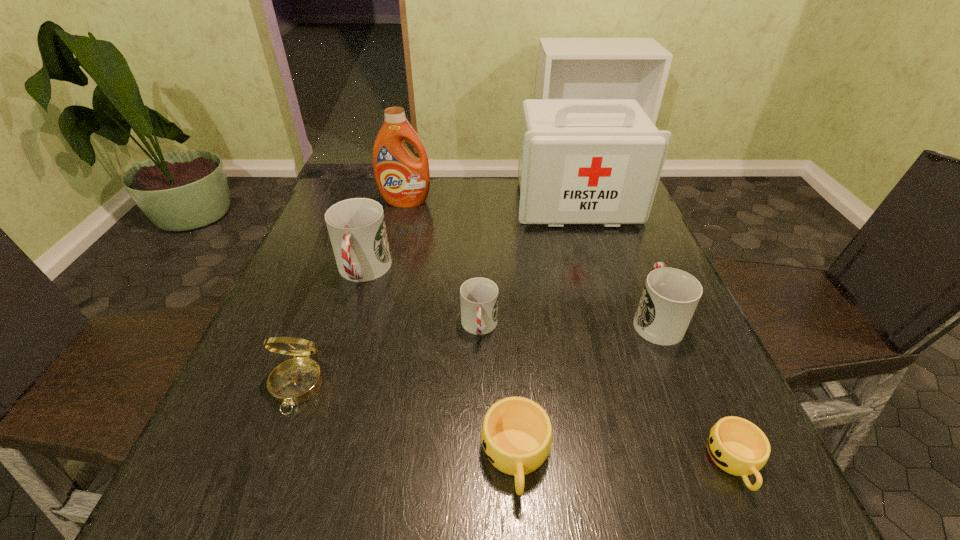
Locate an element on the screen. The image size is (960, 540). free space between the white first-aid kit and the third tallest cup is located at coordinates coord(527,265).

Image resolution: width=960 pixels, height=540 pixels. Identify the location of free spot between the third tallest cup and the second tallest cup. (567, 323).

Find the location of `unoccupied area between the detergent and the second red cup from left to right`. unoccupied area between the detergent and the second red cup from left to right is located at coordinates (443, 265).

The height and width of the screenshot is (540, 960). In order to click on unoccupied area between the sixth shortest object and the third nearest object in this screenshot , I will do `click(329, 329)`.

The image size is (960, 540). Find the location of `vacant area that lies between the first-aid kit and the third tallest object`. vacant area that lies between the first-aid kit and the third tallest object is located at coordinates (469, 237).

Identify the location of free space between the third nearest object and the second biggest red cup. (476, 353).

The image size is (960, 540). In order to click on object that is the fifth closest to the second shortest object in this screenshot , I will do `click(356, 227)`.

Locate an element on the screen. the fifth closest object to the shortest cup is located at coordinates (295, 381).

Where is `cup that stands as the second closest to the first-aid kit`? cup that stands as the second closest to the first-aid kit is located at coordinates (478, 296).

Locate which cup is the third closest to the tallest cup. Please provide its 2D coordinates. Your answer should be formatted as a tuple, i.e. [(x, y)], where the tuple contains the x and y coordinates of a point satisfying the conditions above.

[(670, 296)]